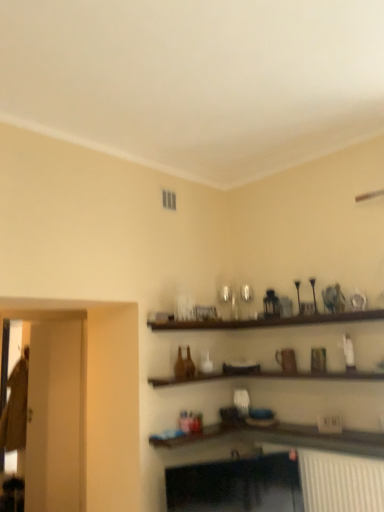
Measure the distance between point (26, 412) and camera.

Point (26, 412) and camera are 4.46 meters apart from each other.

The height and width of the screenshot is (512, 384). I want to click on transparent glass door at left, which is the first glass door from left to right, so click(x=16, y=406).

Describe the element at coordinates (16, 406) in the screenshot. The width and height of the screenshot is (384, 512). I see `transparent glass door at left, positioned as the second glass door in right-to-left order` at that location.

What is the approximate height of transparent glass door at left, the 1th glass door in the right-to-left sequence?

The height of transparent glass door at left, the 1th glass door in the right-to-left sequence, is 1.78 meters.

This screenshot has width=384, height=512. What do you see at coordinates (56, 417) in the screenshot? I see `transparent glass door at left, which is the 1th glass door in front-to-back order` at bounding box center [56, 417].

Measure the distance between point [39,403] and camera.

Point [39,403] is 14.46 feet away from camera.

Measure the distance between transparent glass door at left, which is the 1th glass door in front-to-back order, and camera.

The depth of transparent glass door at left, which is the 1th glass door in front-to-back order, is 12.46 feet.

I want to click on transparent glass door at left, marked as the second glass door in a back-to-front arrangement, so click(x=56, y=417).

You are a GUI agent. You are given a task and a screenshot of the screen. Output one action in this format:
    pyautogui.click(x=<x>, y=<y>)
    Task: Click on the transparent glass door at left, positioned as the second glass door in right-to-left order
    
    Given the screenshot: What is the action you would take?
    pyautogui.click(x=16, y=406)

Is transparent glass door at left, the 1th glass door from the back, to the right of transparent glass door at left, marked as the second glass door in a back-to-front arrangement, from the viewer's perspective?

Incorrect, transparent glass door at left, the 1th glass door from the back, is not on the right side of transparent glass door at left, marked as the second glass door in a back-to-front arrangement.

Considering their positions, is transparent glass door at left, the 1th glass door from the back, located in front of or behind transparent glass door at left, the second glass door in the left-to-right sequence?

transparent glass door at left, the 1th glass door from the back, is positioned farther from the viewer than transparent glass door at left, the second glass door in the left-to-right sequence.

Considering the points (28, 372) and (54, 325), which point is in front, point (28, 372) or point (54, 325)?

The point (54, 325) is closer to the camera.

From the image's perspective, does transparent glass door at left, positioned as the second glass door in right-to-left order, appear higher than transparent glass door at left, which is the 1th glass door in front-to-back order?

No.

From a real-world perspective, between transparent glass door at left, the 2th glass door when ordered from front to back, and transparent glass door at left, which is the 1th glass door in front-to-back order, who is vertically lower?

In real-world perspective, transparent glass door at left, the 2th glass door when ordered from front to back, is lower.

Considering the sizes of objects transparent glass door at left, the 1th glass door from the back, and transparent glass door at left, marked as the second glass door in a back-to-front arrangement, in the image provided, who is wider, transparent glass door at left, the 1th glass door from the back, or transparent glass door at left, marked as the second glass door in a back-to-front arrangement,?

transparent glass door at left, the 1th glass door from the back, is wider.

In terms of height, does transparent glass door at left, the 1th glass door from the back, look taller or shorter compared to transparent glass door at left, which is the 1th glass door in front-to-back order?

transparent glass door at left, the 1th glass door from the back, is shorter than transparent glass door at left, which is the 1th glass door in front-to-back order.

Considering the relative sizes of transparent glass door at left, the 1th glass door from the back, and transparent glass door at left, which is the 1th glass door in front-to-back order, in the image provided, is transparent glass door at left, the 1th glass door from the back, smaller than transparent glass door at left, which is the 1th glass door in front-to-back order,?

No.

Choose the correct answer: Is transparent glass door at left, positioned as the second glass door in right-to-left order, inside transparent glass door at left, the 1th glass door in the right-to-left sequence, or outside it?

transparent glass door at left, positioned as the second glass door in right-to-left order, is spatially situated outside transparent glass door at left, the 1th glass door in the right-to-left sequence.

Does transparent glass door at left, positioned as the second glass door in right-to-left order, touch transparent glass door at left, marked as the second glass door in a back-to-front arrangement?

They are not placed beside each other.

Is transparent glass door at left, the 1th glass door from the back, facing away from transparent glass door at left, the 1th glass door in the right-to-left sequence?

No, transparent glass door at left, the 1th glass door from the back, is not facing the opposite direction of transparent glass door at left, the 1th glass door in the right-to-left sequence.

This screenshot has width=384, height=512. Find the location of `glass door that is below the transparent glass door at left, which is the 1th glass door in front-to-back order (from the image's perspective)`. glass door that is below the transparent glass door at left, which is the 1th glass door in front-to-back order (from the image's perspective) is located at coordinates (16, 406).

Between transparent glass door at left, marked as the second glass door in a back-to-front arrangement, and transparent glass door at left, which is the first glass door from left to right, which one appears on the right side from the viewer's perspective?

transparent glass door at left, marked as the second glass door in a back-to-front arrangement.

In the image, is transparent glass door at left, marked as the second glass door in a back-to-front arrangement, positioned in front of or behind transparent glass door at left, the 2th glass door when ordered from front to back?

Visually, transparent glass door at left, marked as the second glass door in a back-to-front arrangement, is located in front of transparent glass door at left, the 2th glass door when ordered from front to back.

Is point (75, 409) positioned before point (9, 402)?

Yes, it is in front of point (9, 402).

From the image's perspective, between transparent glass door at left, the second glass door in the left-to-right sequence, and transparent glass door at left, the 2th glass door when ordered from front to back, who is located below?

transparent glass door at left, the 2th glass door when ordered from front to back, from the image's perspective.

From a real-world perspective, is transparent glass door at left, the second glass door in the left-to-right sequence, under transparent glass door at left, the 2th glass door when ordered from front to back?

No, from a real-world perspective, transparent glass door at left, the second glass door in the left-to-right sequence, is not beneath transparent glass door at left, the 2th glass door when ordered from front to back.

Is transparent glass door at left, which is the 1th glass door in front-to-back order, thinner than transparent glass door at left, the 1th glass door from the back?

Yes, transparent glass door at left, which is the 1th glass door in front-to-back order, is thinner than transparent glass door at left, the 1th glass door from the back.

Is transparent glass door at left, the second glass door in the left-to-right sequence, taller than transparent glass door at left, the 2th glass door when ordered from front to back?

Yes, transparent glass door at left, the second glass door in the left-to-right sequence, is taller than transparent glass door at left, the 2th glass door when ordered from front to back.

Based on the photo, who is smaller, transparent glass door at left, which is the 1th glass door in front-to-back order, or transparent glass door at left, the 1th glass door from the back?

With smaller size is transparent glass door at left, which is the 1th glass door in front-to-back order.

Is transparent glass door at left, the second glass door in the left-to-right sequence, not inside transparent glass door at left, the 2th glass door when ordered from front to back?

Yes, transparent glass door at left, the second glass door in the left-to-right sequence, is outside of transparent glass door at left, the 2th glass door when ordered from front to back.

Does transparent glass door at left, marked as the second glass door in a back-to-front arrangement, touch transparent glass door at left, which is the first glass door from left to right?

No.

Is transparent glass door at left, the second glass door in the left-to-right sequence, looking in the opposite direction of transparent glass door at left, the 1th glass door from the back?

Yes, transparent glass door at left, the second glass door in the left-to-right sequence,'s orientation is away from transparent glass door at left, the 1th glass door from the back.

I want to click on glass door in front of the transparent glass door at left, the 2th glass door when ordered from front to back, so click(56, 417).

Find the location of a particular element. This screenshot has height=512, width=384. glass door in front of the transparent glass door at left, which is the first glass door from left to right is located at coordinates (56, 417).

This screenshot has height=512, width=384. Find the location of `glass door lying on the left of transparent glass door at left, the 1th glass door in the right-to-left sequence`. glass door lying on the left of transparent glass door at left, the 1th glass door in the right-to-left sequence is located at coordinates (16, 406).